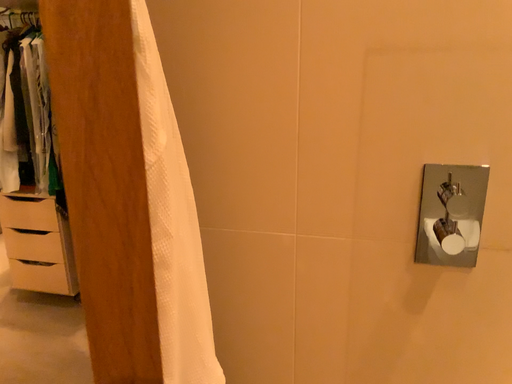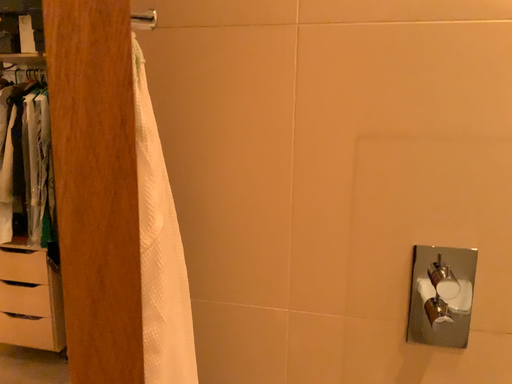
Question: How did the camera likely rotate when shooting the video?

Choices:
 (A) rotated downward
 (B) rotated upward

Answer: (B)